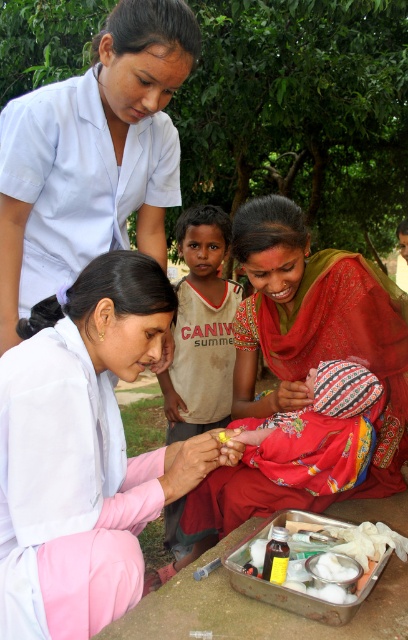
Question: Is white uniform at upper left above matte red sari at center?

Choices:
 (A) yes
 (B) no

Answer: (A)

Question: Which point is farther to the camera?

Choices:
 (A) pyautogui.click(x=61, y=396)
 (B) pyautogui.click(x=212, y=241)

Answer: (B)

Question: Which point is farther to the camera?

Choices:
 (A) white cotton shirt at center
 (B) white fabric shirt at center
 (C) white uniform at upper left

Answer: (A)

Question: Can you confirm if white uniform at upper left is smaller than matte red sari at center?

Choices:
 (A) no
 (B) yes

Answer: (B)

Question: Is white fabric shirt at center positioned before white uniform at upper left?

Choices:
 (A) yes
 (B) no

Answer: (A)

Question: Which of these objects is positioned closest to the white uniform at upper left?

Choices:
 (A) matte red sari at center
 (B) white fabric shirt at center

Answer: (B)